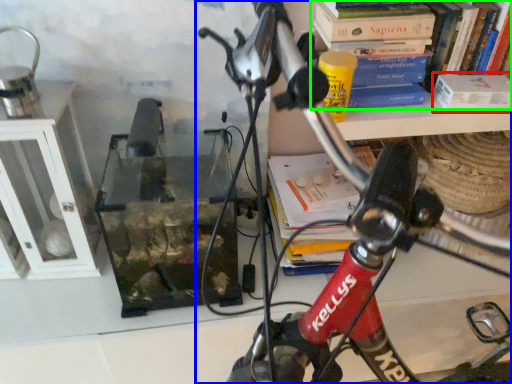
Question: Estimate the real-world distances between objects in this image. Which object is farther from paperback book (highlighted by a red box), bicycle (highlighted by a blue box) or book (highlighted by a green box)?

Choices:
 (A) bicycle
 (B) book

Answer: (A)